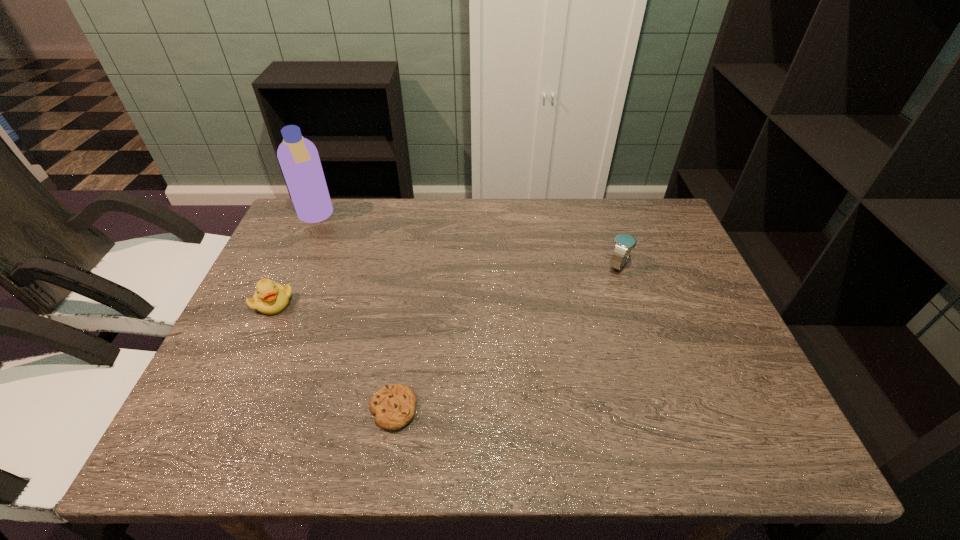
Find the location of `vacant area located on the right of the shortest object`. vacant area located on the right of the shortest object is located at coordinates (445, 409).

Locate an element on the screen. object present at the far edge is located at coordinates (298, 157).

This screenshot has height=540, width=960. Find the location of `object that is at the near edge`. object that is at the near edge is located at coordinates (394, 405).

Locate an element on the screen. shampoo that is at the left edge is located at coordinates [298, 157].

Image resolution: width=960 pixels, height=540 pixels. Identify the location of duckling located at the left edge. tap(270, 298).

Find the location of a particular element. The width and height of the screenshot is (960, 540). object at the far left corner is located at coordinates (298, 157).

This screenshot has width=960, height=540. I want to click on vacant space at the far edge of the desktop, so click(539, 205).

In the image, there is a desktop. At what (x,y) coordinates should I click in order to perform the action: click on blank space at the near edge. Please return your answer as a coordinate pair (x, y). The height and width of the screenshot is (540, 960). Looking at the image, I should click on (517, 428).

You are a GUI agent. You are given a task and a screenshot of the screen. Output one action in this format:
    pyautogui.click(x=<x>, y=<y>)
    Task: Click on the free point at the left edge
    The width and height of the screenshot is (960, 540).
    Given the screenshot: What is the action you would take?
    pyautogui.click(x=240, y=396)

Where is `free location at the right edge of the desktop`? free location at the right edge of the desktop is located at coordinates (710, 307).